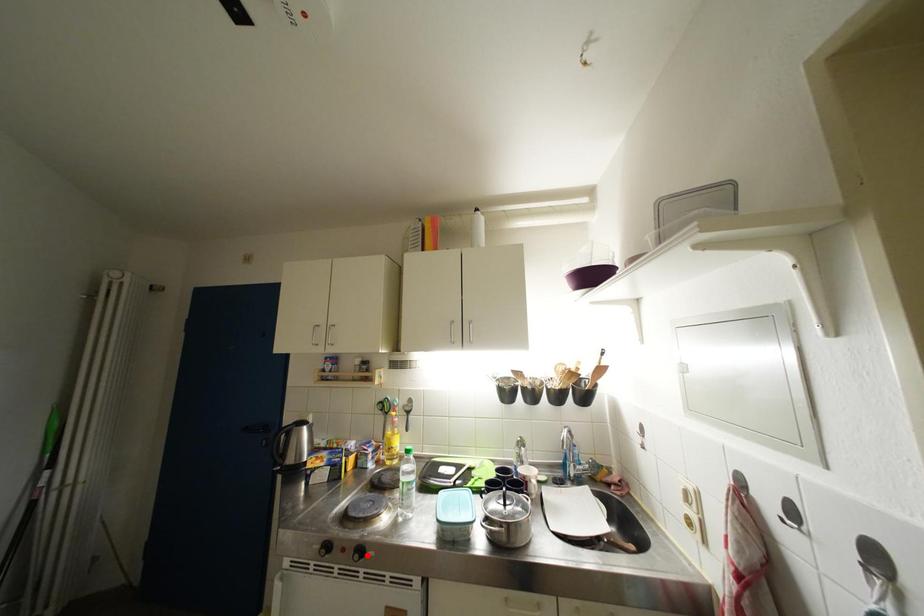
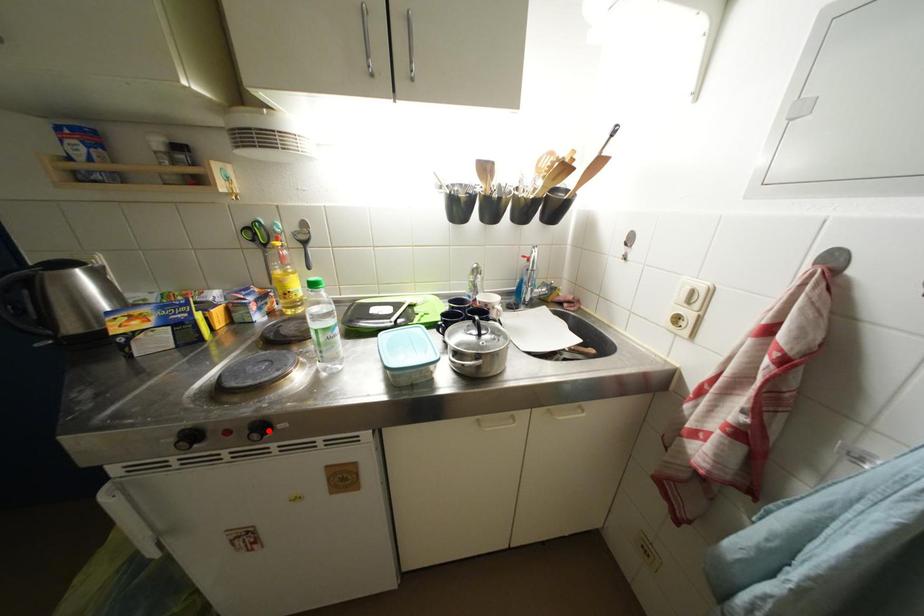
I am providing you with two images of the same scene from different viewpoints. A red point is marked on the first image and another point is marked on the second image. Do the highlighted points in image1 and image2 indicate the same real-world spot?

Yes